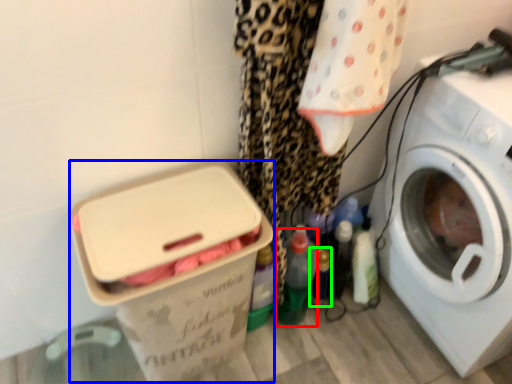
Question: Estimate the real-world distances between objects in this image. Which object is closer to bottle (highlighted by a red box), box (highlighted by a blue box) or bottle (highlighted by a green box)?

Choices:
 (A) box
 (B) bottle

Answer: (B)